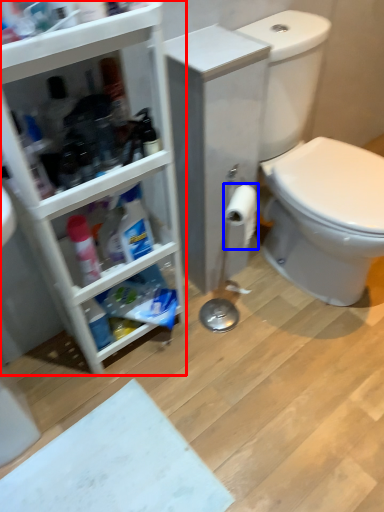
Question: Which object appears farthest to the camera in this image, bathroom cabinet (highlighted by a red box) or toilet paper (highlighted by a blue box)?

Choices:
 (A) bathroom cabinet
 (B) toilet paper

Answer: (B)